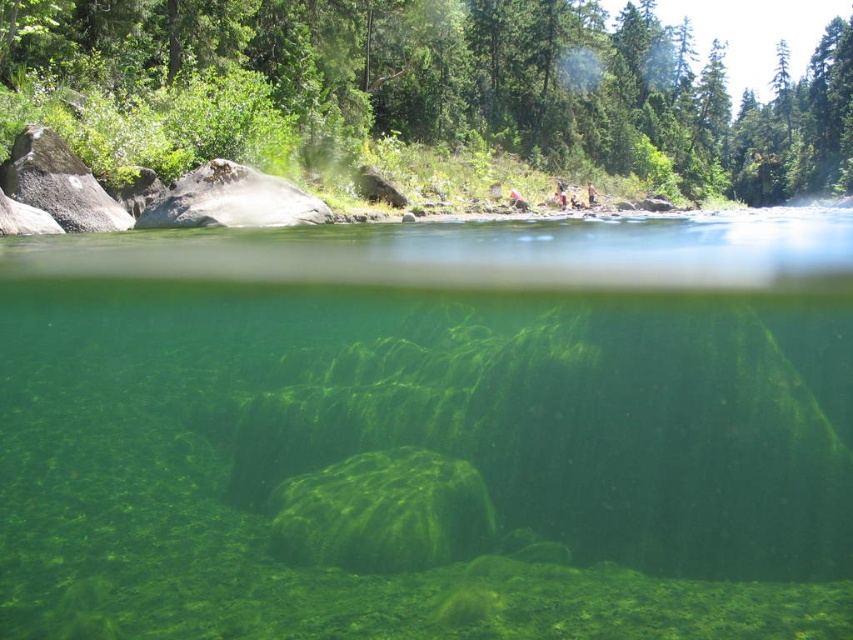
You are a photographer trying to capture the reflection of the green leafy tree at upper center in the water below. However, there is transparent green algae at center blocking the view. Based on their positions, can you adjust your angle to see the reflection without the algae obstructing it?

The transparent green algae at center is positioned on the left side of green leafy tree at upper center. By moving to the right side of the algae, you can position yourself so that the reflection of the green leafy tree at upper center is visible without the algae obstructing the view.

You are a nature photographer planning to capture the underwater scene in the image. You have a camera with a wide angle lens that can capture a large area. Which object, the transparent green algae at center or the green leafy tree at upper center, will be more challenging to fit into a single frame due to its size?

The green leafy tree at upper center will be more challenging to fit into a single frame because it occupies more space than the transparent green algae at center.